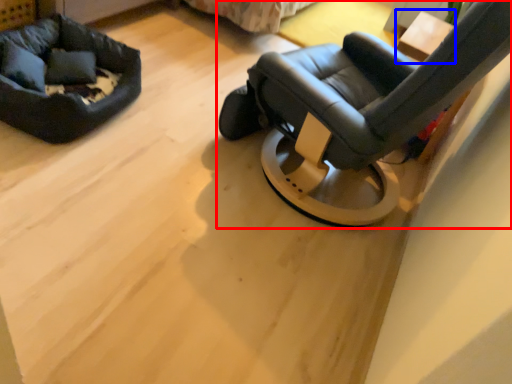
Question: Which of the following is the closest to the observer, chair (highlighted by a red box) or table (highlighted by a blue box)?

Choices:
 (A) chair
 (B) table

Answer: (A)